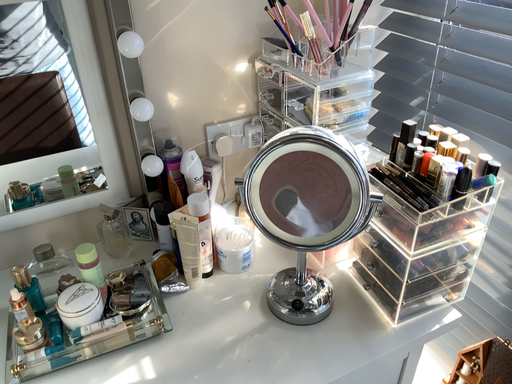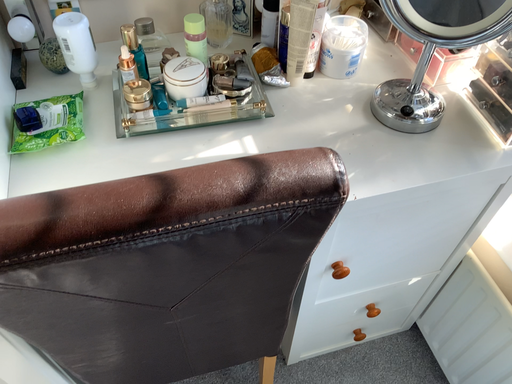
Question: Which way did the camera rotate in the video?

Choices:
 (A) rotated downward
 (B) rotated upward

Answer: (A)